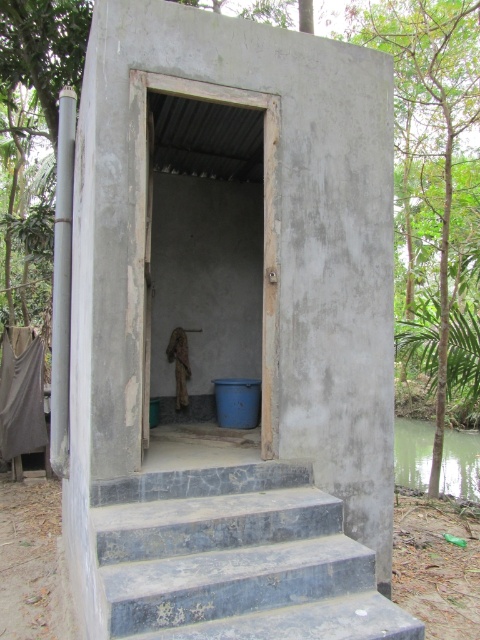
You are standing at the entrance of the outdoor toilet and want to know which object is taller between the smooth concrete hut at center and the dark gray concrete stairs at lower center. Can you tell me?

The smooth concrete hut at center is taller than the dark gray concrete stairs at lower center according to the description.

You are standing in front of the outdoor toilet structure and notice two points marked on the wall. Which point, point [210,621] or point [349,541], is closer to you?

Point [210,621] is closer to you than point [349,541].